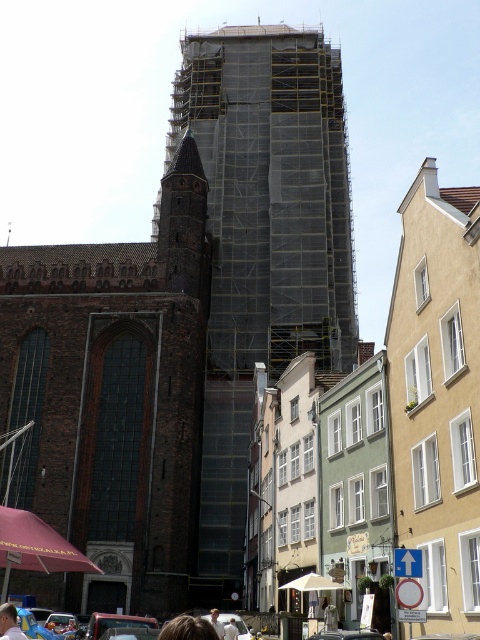
Question: In this image, where is dark gray scaffolding at center located relative to light blue shirt at lower left?

Choices:
 (A) left
 (B) right

Answer: (B)

Question: Which of the following is the closest to the observer?

Choices:
 (A) (190, 230)
 (B) (1, 620)

Answer: (B)

Question: Is dark gray scaffolding at center below light brown hair at lower center?

Choices:
 (A) no
 (B) yes

Answer: (A)

Question: Among these objects, which one is nearest to the camera?

Choices:
 (A) light brown hair at lower center
 (B) dark gray scaffolding at center

Answer: (A)

Question: Which is nearer to the dark gray scaffolding at center?

Choices:
 (A) brown stone church at left
 (B) light brown hair at lower center
 (C) light blue shirt at lower left

Answer: (A)

Question: Observing the image, what is the correct spatial positioning of brown stone church at left in reference to light blue shirt at lower left?

Choices:
 (A) above
 (B) below

Answer: (A)